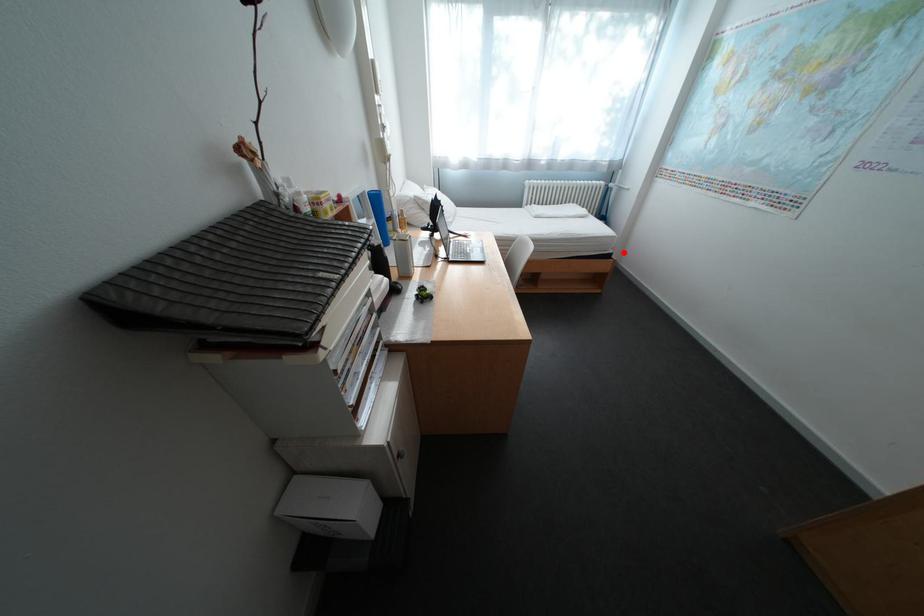
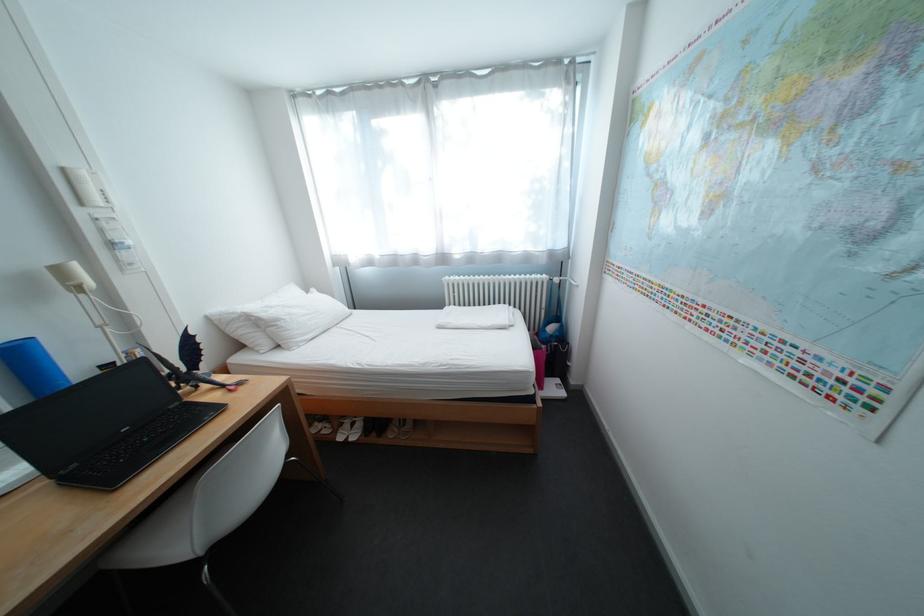
Question: I am providing you with two images of the same scene from different viewpoints. Image1 has a red point marked. In image2, the corresponding 3D location appears at what relative position? Reply with the corresponding letter.

Choices:
 (A) Closer
 (B) Farther

Answer: (B)